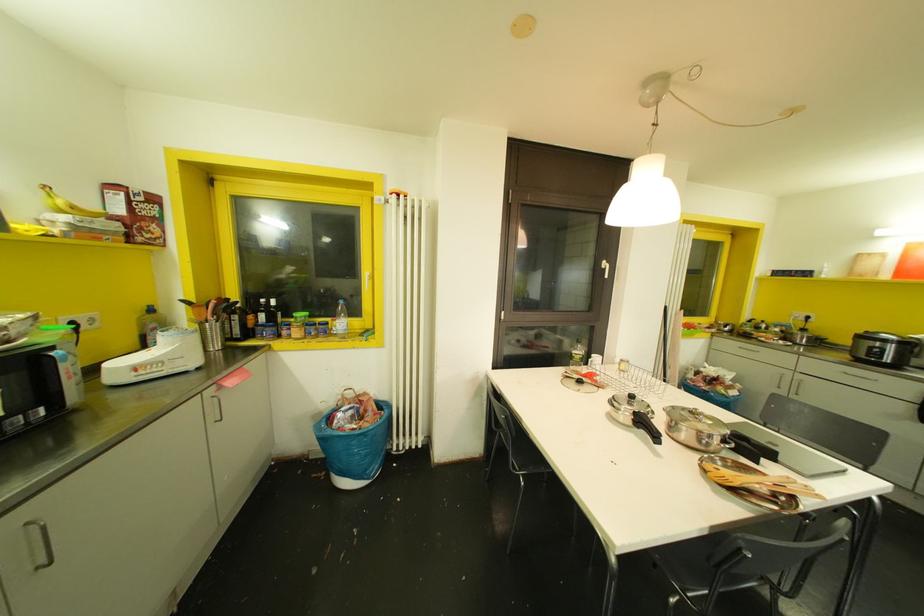
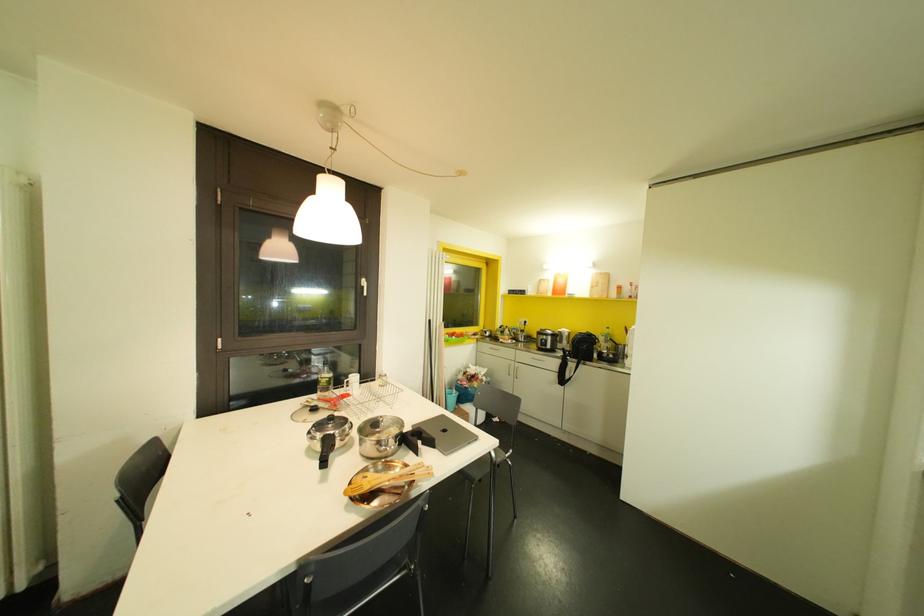
Question: Based on the continuous images, in which direction is the camera rotating? Reply with the corresponding letter.

Choices:
 (A) Left
 (B) Right
 (C) Up
 (D) Down

Answer: (B)